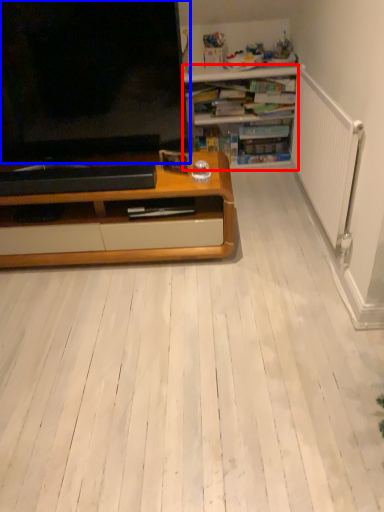
Question: Which object is closer to the camera taking this photo, desk (highlighted by a red box) or television (highlighted by a blue box)?

Choices:
 (A) desk
 (B) television

Answer: (B)